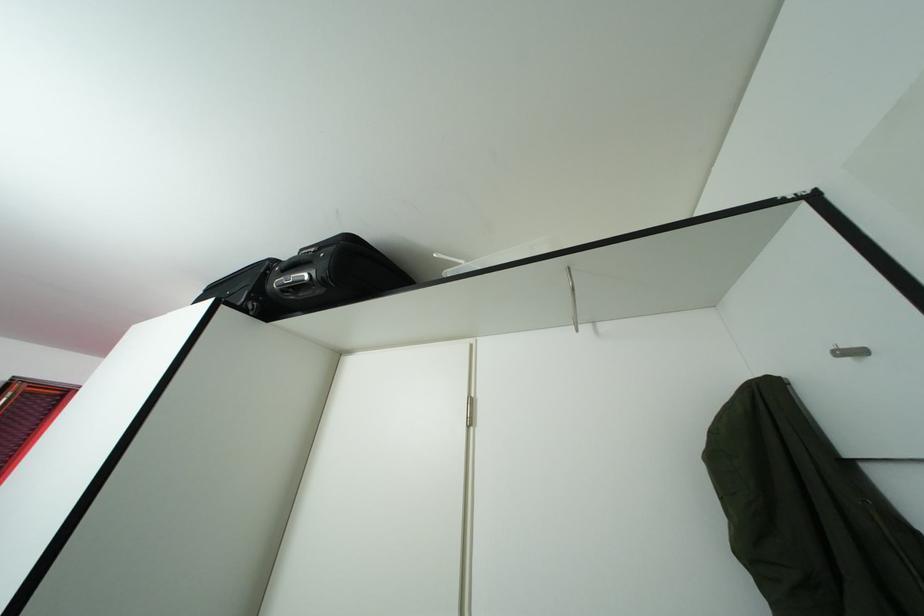
What are the coordinates of `black suitcase handle` in the screenshot? It's located at (294, 262).